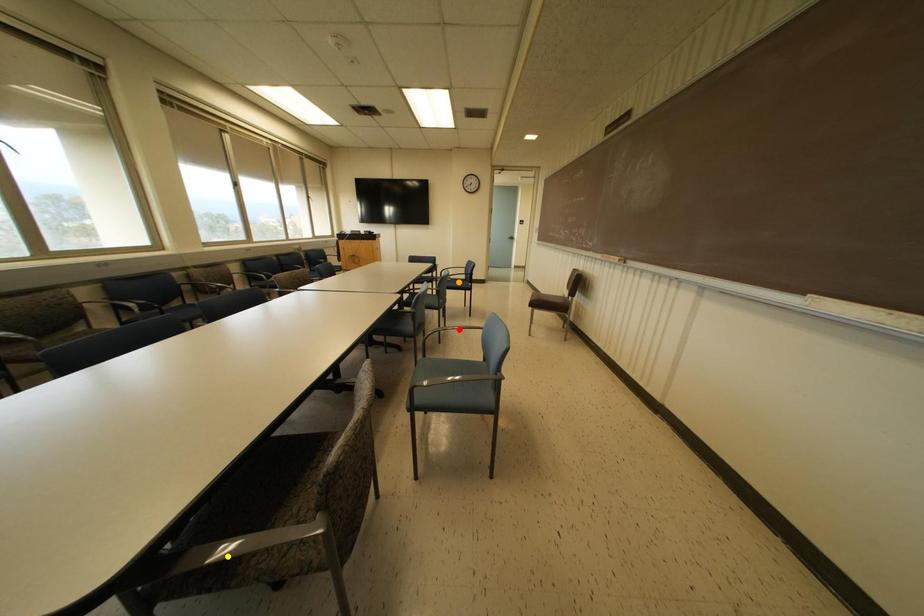
In the scene shown: Order these from nearest to farthest:
1. yellow point
2. orange point
3. red point

yellow point < red point < orange point